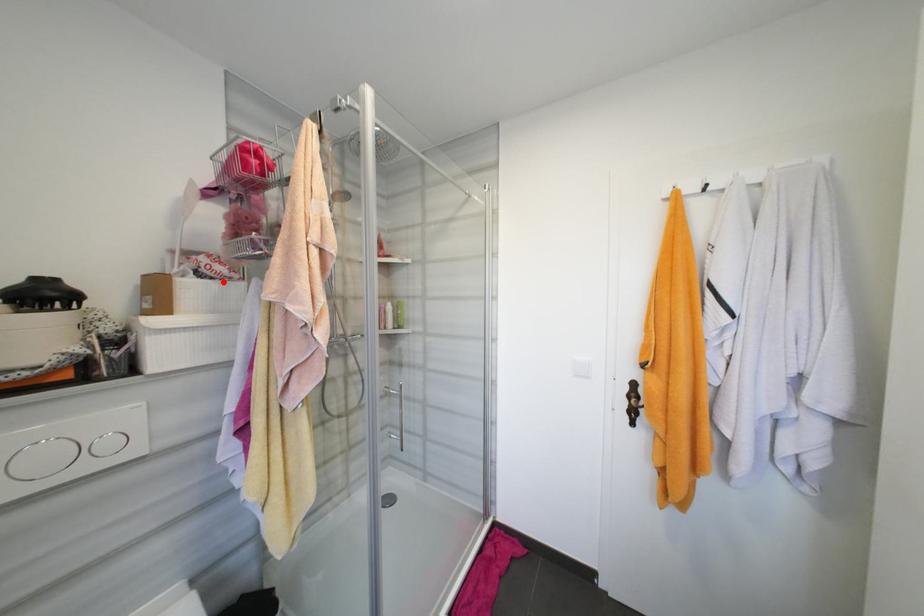
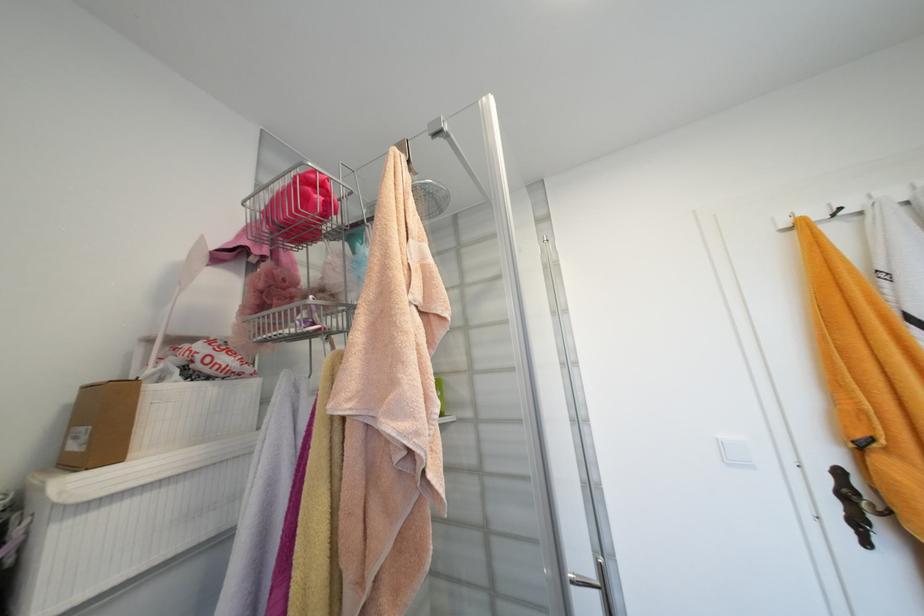
Locate, in the second image, the point that corresponds to the highlighted location in the first image.

(224, 383)